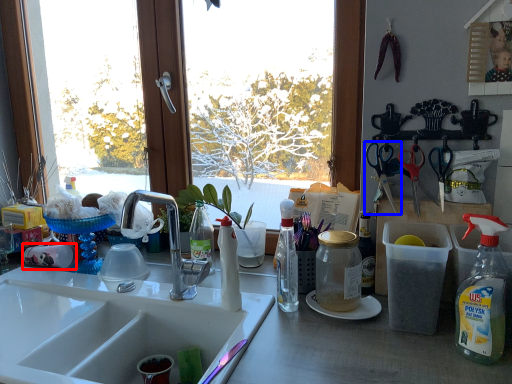
Question: Which object appears farthest to the camera in this image, coffee cup (highlighted by a red box) or scissors (highlighted by a blue box)?

Choices:
 (A) coffee cup
 (B) scissors

Answer: (A)